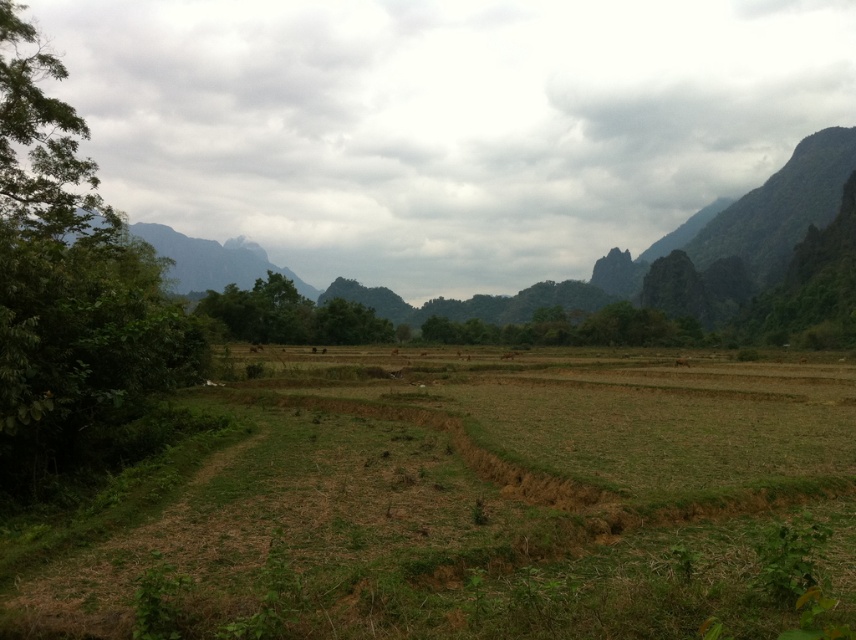
Question: Which is nearer to the green leafy tree at left?

Choices:
 (A) rugged granite mountain at upper left
 (B) green grassy field at center

Answer: (B)

Question: Can you confirm if green grassy field at center is positioned to the left of rugged granite mountain at upper left?

Choices:
 (A) yes
 (B) no

Answer: (B)

Question: Among these objects, which one is farthest from the camera?

Choices:
 (A) green grassy field at center
 (B) rugged granite mountain at upper left
 (C) green leafy tree at left

Answer: (B)

Question: Can you confirm if green grassy field at center is positioned below green leafy tree at left?

Choices:
 (A) no
 (B) yes

Answer: (B)

Question: Which of the following is the farthest from the observer?

Choices:
 (A) rugged granite mountain at upper left
 (B) green leafy tree at left

Answer: (A)

Question: Can you confirm if green grassy field at center is positioned to the left of green leafy tree at left?

Choices:
 (A) yes
 (B) no

Answer: (B)